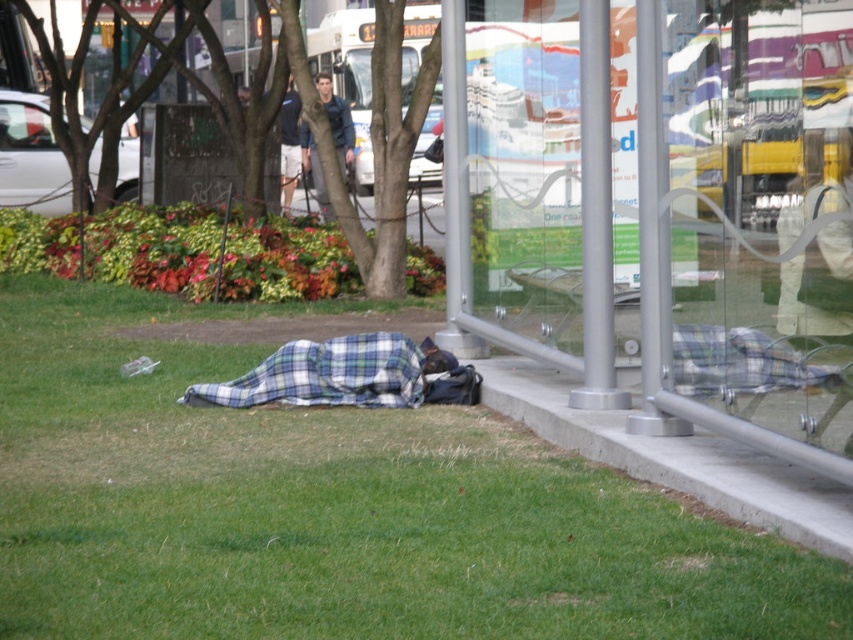
Question: Which object appears farthest from the camera in this image?

Choices:
 (A) green grass at lower left
 (B) plaid fabric blanket at lower center

Answer: (B)

Question: Which point is closer to the camera taking this photo?

Choices:
 (A) (370, 362)
 (B) (341, 132)

Answer: (A)

Question: Which of these objects is positioned closest to the concrete at lower right?

Choices:
 (A) blue denim jacket at upper center
 (B) plaid fabric blanket at lower center
 (C) clear glass bench at lower right

Answer: (C)

Question: Where is clear glass bench at lower right located in relation to dark blue shirt at center in the image?

Choices:
 (A) above
 (B) below

Answer: (B)

Question: Can you confirm if green grass at lower left is positioned to the right of plaid fabric blanket at lower center?

Choices:
 (A) yes
 (B) no

Answer: (B)

Question: Does concrete at lower right lie in front of blue denim jacket at upper center?

Choices:
 (A) yes
 (B) no

Answer: (A)